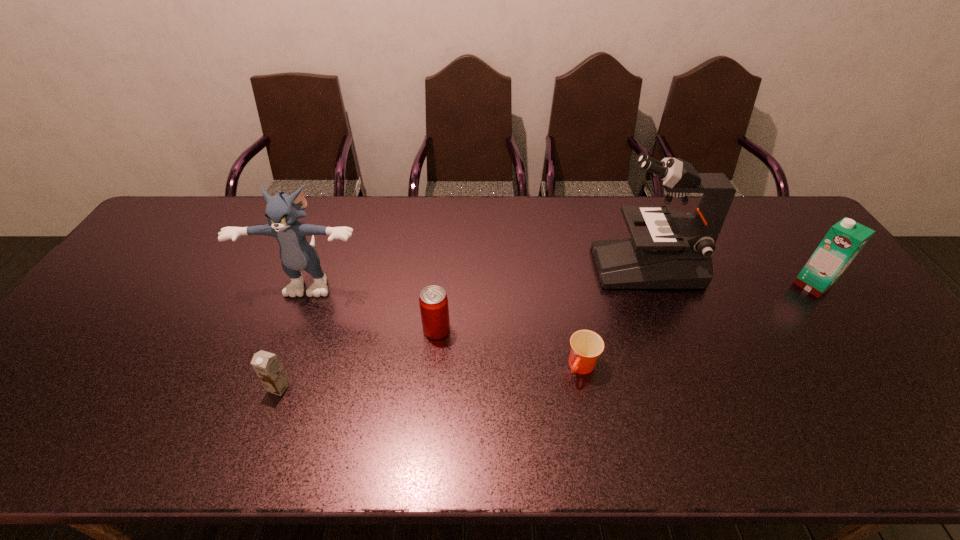
Locate an element on the screen. vacant space positioned through the eyepieces of the fifth object from left to right is located at coordinates (496, 266).

This screenshot has height=540, width=960. I want to click on free spot located 0.250m through the eyepieces of the fifth object from left to right, so click(513, 266).

Find the location of `free space located on the front-facing side of the cat`. free space located on the front-facing side of the cat is located at coordinates (299, 316).

The image size is (960, 540). What are the coordinates of `vacant space situated on the left of the third tallest object` in the screenshot? It's located at point(674,285).

Image resolution: width=960 pixels, height=540 pixels. I want to click on free space located 0.130m on the front of the can, so click(432, 385).

Identify the location of free space located on the left of the chocolate milk. The width and height of the screenshot is (960, 540). (172, 387).

This screenshot has height=540, width=960. Find the location of `free space located on the back of the fourth object from left to right`. free space located on the back of the fourth object from left to right is located at coordinates (563, 266).

Find the location of `object that is at the right edge`. object that is at the right edge is located at coordinates (845, 239).

This screenshot has height=540, width=960. I want to click on free location at the far edge of the desktop, so click(x=492, y=228).

Identify the location of free space at the near edge of the desktop. The height and width of the screenshot is (540, 960). (625, 432).